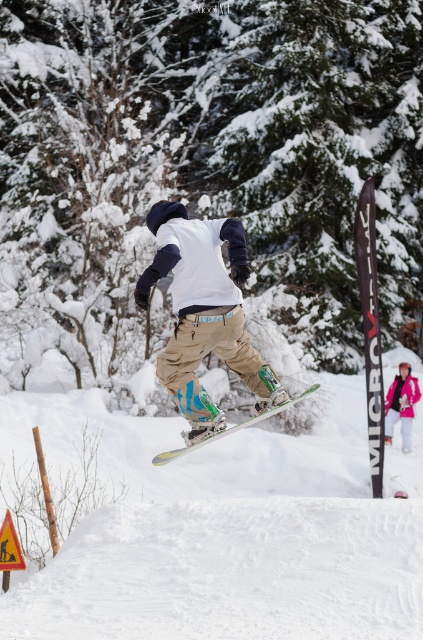
Does matte khaki pants at center appear over pink fabric jacket at lower right?

Yes.

Where is `matte khaki pants at center`? The height and width of the screenshot is (640, 423). matte khaki pants at center is located at coordinates (203, 312).

Who is more distant from viewer, (379, 512) or (211, 433)?

The point (379, 512) is behind.

Can you confirm if white fluffy snow at center is shorter than shiny metallic snowboard at center?

No.

Locate an element on the screen. The width and height of the screenshot is (423, 640). white fluffy snow at center is located at coordinates point(225,531).

Where is `white fluffy snow at center`? The height and width of the screenshot is (640, 423). white fluffy snow at center is located at coordinates (225, 531).

Is point (401, 436) in front of point (285, 404)?

No, it is not.

Looking at this image, which is above, pink fabric jacket at lower right or shiny metallic snowboard at center?

shiny metallic snowboard at center is above.

Is point (392, 413) in front of point (258, 417)?

No.

At what (x,y) coordinates should I click in order to perform the action: click on pink fabric jacket at lower right. Please return your answer as a coordinate pair (x, y). This screenshot has height=640, width=423. Looking at the image, I should click on (401, 404).